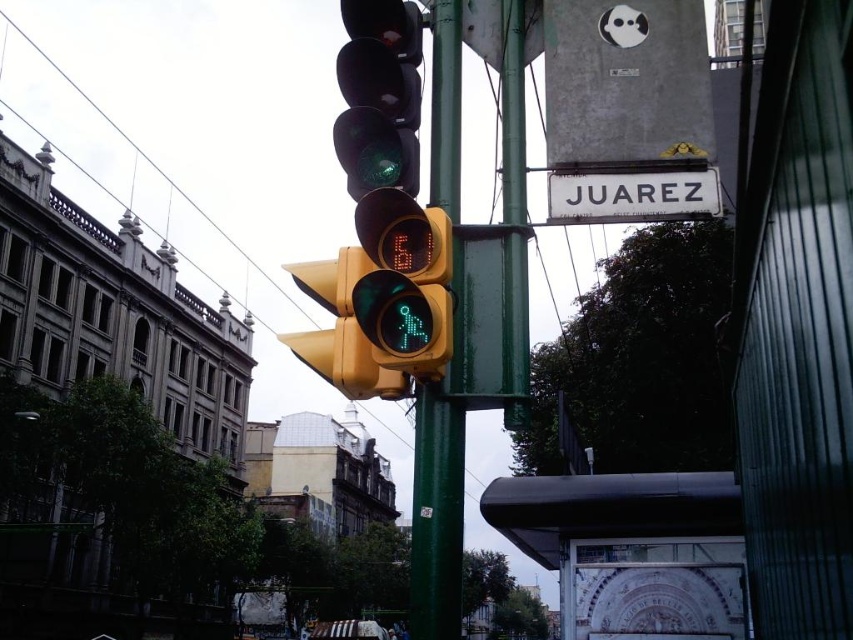
The width and height of the screenshot is (853, 640). What do you see at coordinates (341, 330) in the screenshot?
I see `yellow matte pedestrian signal at center` at bounding box center [341, 330].

Can you confirm if yellow matte pedestrian signal at center is shorter than white plastic street sign at upper center?

In fact, yellow matte pedestrian signal at center may be taller than white plastic street sign at upper center.

You are a GUI agent. You are given a task and a screenshot of the screen. Output one action in this format:
    pyautogui.click(x=<x>, y=<y>)
    Task: Click on the yellow matte pedestrian signal at center
    
    Given the screenshot: What is the action you would take?
    pyautogui.click(x=341, y=330)

Where is `yellow matte pedestrian signal at center`? yellow matte pedestrian signal at center is located at coordinates click(341, 330).

Does green metallic pole at center have a greater height compared to green matte pedestrian signal at center?

Yes.

Between point (457, 564) and point (433, 362), which one is positioned behind?

Point (457, 564)

What do you see at coordinates (436, 513) in the screenshot? The image size is (853, 640). I see `green metallic pole at center` at bounding box center [436, 513].

Locate an element on the screen. The image size is (853, 640). green metallic pole at center is located at coordinates (436, 513).

Can you confirm if yellow matte pedestrian signal at center is wider than metallic wire at upper left?

Incorrect, yellow matte pedestrian signal at center's width does not surpass metallic wire at upper left's.

Does point (351, 368) come behind point (44, 52)?

No, it is in front of (44, 52).

Measure the distance between yellow matte pedestrian signal at center and camera.

yellow matte pedestrian signal at center is 21.76 meters from camera.

The width and height of the screenshot is (853, 640). Find the location of `yellow matte pedestrian signal at center`. yellow matte pedestrian signal at center is located at coordinates (341, 330).